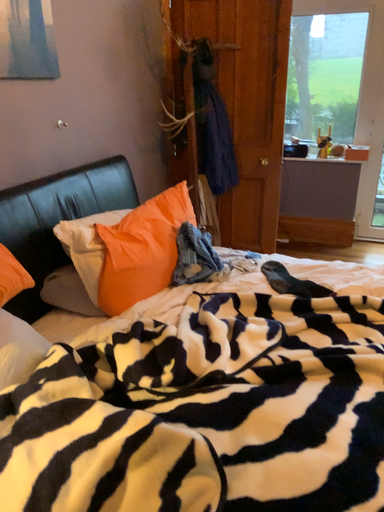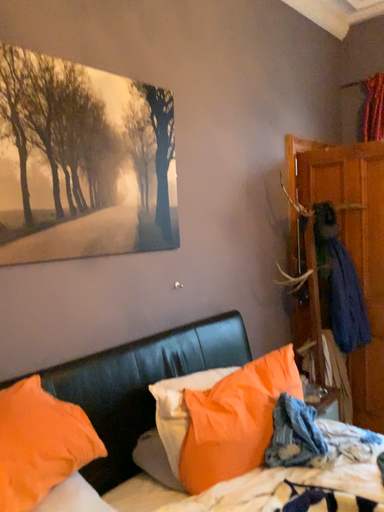
Question: Which way did the camera rotate in the video?

Choices:
 (A) rotated left
 (B) rotated right

Answer: (A)